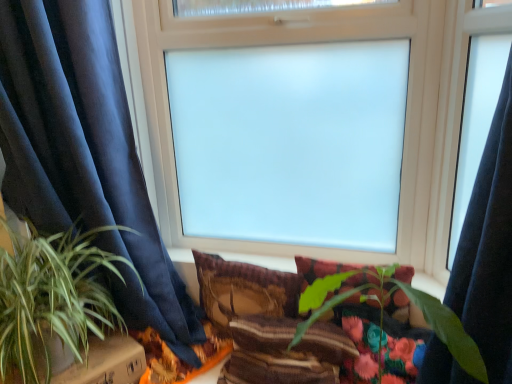
Where is `textured brown pillow at center, the 3th pillow viewed from the right`? The image size is (512, 384). textured brown pillow at center, the 3th pillow viewed from the right is located at coordinates (244, 289).

Describe the element at coordinates (323, 269) in the screenshot. I see `plush fabric pillow at center, which is counted as the first pillow, starting from the right` at that location.

Where is `striped fabric pillow at center, the second pillow viewed from the right`? striped fabric pillow at center, the second pillow viewed from the right is located at coordinates (284, 352).

Measure the distance between point (344, 292) and camera.

A distance of 38.70 inches exists between point (344, 292) and camera.

Where is `cardboard box at lower left`? The image size is (512, 384). cardboard box at lower left is located at coordinates (106, 363).

This screenshot has width=512, height=384. I want to click on textured brown pillow at center, the 3th pillow viewed from the right, so click(x=244, y=289).

From a real-world perspective, between plush fabric pillow at center, which is counted as the first pillow, starting from the right, and dark blue fabric curtain at left, who is vertically higher?

From a 3D spatial view, dark blue fabric curtain at left is above.

Considering the relative sizes of plush fabric pillow at center, which is the third pillow from left to right, and dark blue fabric curtain at left in the image provided, is plush fabric pillow at center, which is the third pillow from left to right, smaller than dark blue fabric curtain at left?

Yes.

This screenshot has height=384, width=512. In order to click on the 2nd pillow below when counting from the dark blue fabric curtain at left (from the image's perspective) in this screenshot , I will do `click(323, 269)`.

Does plush fabric pillow at center, which is counted as the first pillow, starting from the right, appear on the right side of dark blue fabric curtain at left?

Correct, you'll find plush fabric pillow at center, which is counted as the first pillow, starting from the right, to the right of dark blue fabric curtain at left.

In the scene shown: From their relative heights in the image, would you say textured brown pillow at center, the 3th pillow viewed from the right, is taller or shorter than dark blue fabric curtain at left?

textured brown pillow at center, the 3th pillow viewed from the right, is shorter than dark blue fabric curtain at left.

Are textured brown pillow at center, the 3th pillow viewed from the right, and dark blue fabric curtain at left located far from each other?

No, textured brown pillow at center, the 3th pillow viewed from the right, is not far away from dark blue fabric curtain at left.

This screenshot has width=512, height=384. What are the coordinates of `the 1st pillow below the dark blue fabric curtain at left (from the image's perspective)` in the screenshot? It's located at (244, 289).

From the image's perspective, is textured brown pillow at center, the first pillow from the left, on top of dark blue fabric curtain at left?

Actually, textured brown pillow at center, the first pillow from the left, appears below dark blue fabric curtain at left in the image.

The width and height of the screenshot is (512, 384). I want to click on window behind the dark blue fabric curtain at left, so click(x=294, y=43).

Does frosted glass window at center appear on the right side of dark blue fabric curtain at left?

Indeed, frosted glass window at center is positioned on the right side of dark blue fabric curtain at left.

From the image's perspective, is frosted glass window at center located above or below dark blue fabric curtain at left?

Based on their image positions, frosted glass window at center is located above dark blue fabric curtain at left.

Looking at this image, considering the relative sizes of frosted glass window at center and dark blue fabric curtain at left in the image provided, is frosted glass window at center bigger than dark blue fabric curtain at left?

Actually, frosted glass window at center might be smaller than dark blue fabric curtain at left.

Is striped fabric pillow at center, marked as the 2th pillow in a left-to-right arrangement, aimed at cardboard box at lower left?

No, striped fabric pillow at center, marked as the 2th pillow in a left-to-right arrangement, is not oriented towards cardboard box at lower left.

Which is less distant, [229,383] or [123,338]?

Point [229,383] is positioned closer to the camera compared to point [123,338].

Find the location of a particular element. This screenshot has height=384, width=512. furniture on the left of striped fabric pillow at center, the second pillow viewed from the right is located at coordinates (106, 363).

Measure the distance from striped fabric pillow at center, the second pillow viewed from the right, to cardboard box at lower left.

17.67 inches.

Between dark blue fabric curtain at left and striped fabric pillow at center, marked as the 2th pillow in a left-to-right arrangement, which one appears on the left side from the viewer's perspective?

dark blue fabric curtain at left is more to the left.

Considering the relative sizes of dark blue fabric curtain at left and striped fabric pillow at center, the second pillow viewed from the right, in the image provided, is dark blue fabric curtain at left smaller than striped fabric pillow at center, the second pillow viewed from the right,?

No, dark blue fabric curtain at left is not smaller than striped fabric pillow at center, the second pillow viewed from the right.

Is dark blue fabric curtain at left touching striped fabric pillow at center, marked as the 2th pillow in a left-to-right arrangement?

dark blue fabric curtain at left is not next to striped fabric pillow at center, marked as the 2th pillow in a left-to-right arrangement, and they're not touching.

Can you tell me how much dark blue fabric curtain at left and striped fabric pillow at center, marked as the 2th pillow in a left-to-right arrangement, differ in facing direction?

The angle between the facing direction of dark blue fabric curtain at left and the facing direction of striped fabric pillow at center, marked as the 2th pillow in a left-to-right arrangement, is 62.9 degrees.

Considering the relative positions of cardboard box at lower left and frosted glass window at center in the image provided, is cardboard box at lower left to the right of frosted glass window at center from the viewer's perspective?

Incorrect, cardboard box at lower left is not on the right side of frosted glass window at center.

Who is taller, cardboard box at lower left or frosted glass window at center?

frosted glass window at center is taller.

Is cardboard box at lower left not inside frosted glass window at center?

Absolutely, cardboard box at lower left is external to frosted glass window at center.

From the image's perspective, does cardboard box at lower left appear higher than frosted glass window at center?

Actually, cardboard box at lower left appears below frosted glass window at center in the image.

From a real-world perspective, which is physically below, green leafy plant at left, marked as the 2th houseplant in a right-to-left arrangement, or plush fabric pillow at center, which is the third pillow from left to right?

In real-world perspective, plush fabric pillow at center, which is the third pillow from left to right, is lower.

Is the position of green leafy plant at left, marked as the 1th houseplant in a left-to-right arrangement, more distant than that of plush fabric pillow at center, which is counted as the first pillow, starting from the right?

No, it is in front of plush fabric pillow at center, which is counted as the first pillow, starting from the right.

Could you measure the distance between green leafy plant at left, marked as the 1th houseplant in a left-to-right arrangement, and plush fabric pillow at center, which is the third pillow from left to right?

green leafy plant at left, marked as the 1th houseplant in a left-to-right arrangement, and plush fabric pillow at center, which is the third pillow from left to right, are 29.42 inches apart.

Between green leafy plant at left, marked as the 2th houseplant in a right-to-left arrangement, and plush fabric pillow at center, which is counted as the first pillow, starting from the right, which one has smaller width?

With smaller width is plush fabric pillow at center, which is counted as the first pillow, starting from the right.

Image resolution: width=512 pixels, height=384 pixels. In order to click on curtain above the plush fabric pillow at center, which is the third pillow from left to right (from the image's perspective) in this screenshot , I will do (85, 155).

From the dark blue fabric curtain at left, count 1st pillow to the right and point to it. Please provide its 2D coordinates.

[(244, 289)]

Estimate the real-world distances between objects in this image. Which object is further from dark blue fabric curtain at left, green leafy plant at left, marked as the 1th houseplant in a left-to-right arrangement, or frosted glass window at center?

Based on the image, frosted glass window at center appears to be further to dark blue fabric curtain at left.

Estimate the real-world distances between objects in this image. Which object is closer to striped fabric pillow at center, the second pillow viewed from the right, cardboard box at lower left or green leafy plant at left, marked as the 2th houseplant in a right-to-left arrangement?

The object closer to striped fabric pillow at center, the second pillow viewed from the right, is cardboard box at lower left.

Looking at the image, which one is located further to dark blue fabric curtain at left, green leafy plant at center, arranged as the 1th houseplant when viewed from the right, or cardboard box at lower left?

Based on the image, green leafy plant at center, arranged as the 1th houseplant when viewed from the right, appears to be further to dark blue fabric curtain at left.

Estimate the real-world distances between objects in this image. Which object is further from green leafy plant at left, marked as the 2th houseplant in a right-to-left arrangement, striped fabric pillow at center, the second pillow viewed from the right, or frosted glass window at center?

frosted glass window at center lies further to green leafy plant at left, marked as the 2th houseplant in a right-to-left arrangement, than the other object.

Which object lies further to the anchor point striped fabric pillow at center, marked as the 2th pillow in a left-to-right arrangement, green leafy plant at left, marked as the 1th houseplant in a left-to-right arrangement, or dark blue fabric curtain at left?

green leafy plant at left, marked as the 1th houseplant in a left-to-right arrangement, is positioned further to the anchor striped fabric pillow at center, marked as the 2th pillow in a left-to-right arrangement.

Looking at this image, considering their positions, is striped fabric pillow at center, marked as the 2th pillow in a left-to-right arrangement, positioned further to plush fabric pillow at center, which is counted as the first pillow, starting from the right, than frosted glass window at center?

Based on the image, frosted glass window at center appears to be further to plush fabric pillow at center, which is counted as the first pillow, starting from the right.

Based on their spatial positions, is textured brown pillow at center, the first pillow from the left, or green leafy plant at center, placed as the 2th houseplant when sorted from left to right, closer to green leafy plant at left, marked as the 1th houseplant in a left-to-right arrangement?

Result: textured brown pillow at center, the first pillow from the left.

Estimate the real-world distances between objects in this image. Which object is closer to dark blue fabric curtain at left, green leafy plant at center, arranged as the 1th houseplant when viewed from the right, or green leafy plant at left, marked as the 2th houseplant in a right-to-left arrangement?

green leafy plant at left, marked as the 2th houseplant in a right-to-left arrangement, is closer to dark blue fabric curtain at left.

Locate an element on the screen. pillow situated between green leafy plant at left, marked as the 2th houseplant in a right-to-left arrangement, and striped fabric pillow at center, marked as the 2th pillow in a left-to-right arrangement, from left to right is located at coordinates (244, 289).

Where is `curtain that lies between frosted glass window at center and cardboard box at lower left from top to bottom`? This screenshot has height=384, width=512. curtain that lies between frosted glass window at center and cardboard box at lower left from top to bottom is located at coordinates (85, 155).

Find the location of a particular element. This screenshot has height=384, width=512. houseplant located between green leafy plant at left, marked as the 2th houseplant in a right-to-left arrangement, and plush fabric pillow at center, which is the third pillow from left to right, in the left-right direction is located at coordinates (383, 310).

Find the location of `curtain between green leafy plant at left, marked as the 1th houseplant in a left-to-right arrangement, and green leafy plant at center, placed as the 2th houseplant when sorted from left to right, in the horizontal direction`. curtain between green leafy plant at left, marked as the 1th houseplant in a left-to-right arrangement, and green leafy plant at center, placed as the 2th houseplant when sorted from left to right, in the horizontal direction is located at coordinates (85, 155).